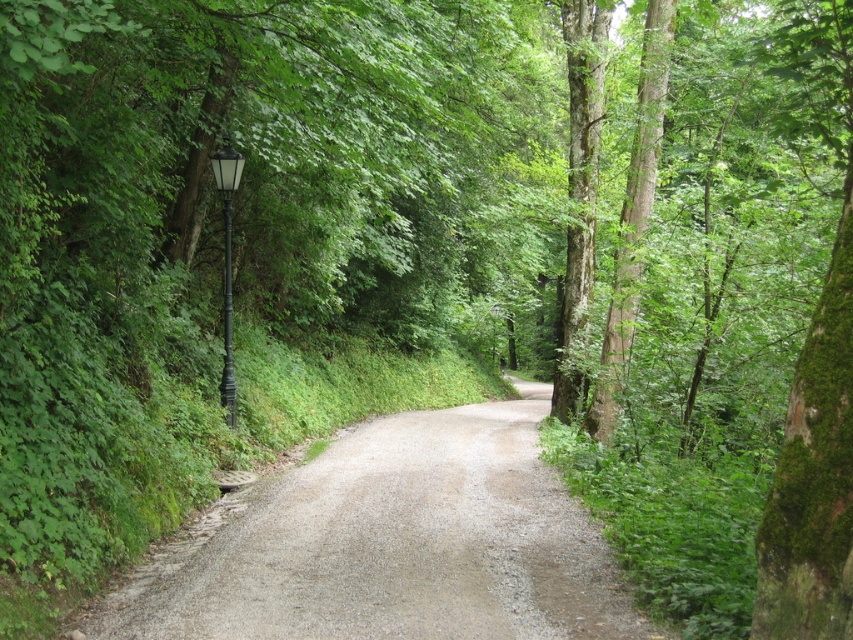
You are standing at the start of the gravel path in the forest. You notice two points marked on the path. The first point is at coordinates point (202, 536) and the second point is at point (227, 266). If you were to walk along the path from the starting point, which point would you reach first?

You would reach point (202, 536) first because it is closer to the camera than point (227, 266), meaning it is nearer to your starting position.

You are a hiker who wants to carry a 1.2 meter wide camping tent through the path between the green rough bark tree at center and the black metal lamp post at left. Can the tent pass through the path? Please explain your reasoning.

The green rough bark tree at center has a lesser width compared to black metal lamp post at left. The black metal lamp post at left is wider than the tree. However, the total width of the path isnecessary to determine if the tent can pass. Since the description only compares their widths but not the path width, we cannot confirm if the tent can pass through. More information about the path width is needed.

You are standing at the starting point of the gravel path in the forest. You notice two points marked on the path. The first point is at coordinates point (276,484) and the second point is at coordinates point (654,90). If you want to reach the point that is closer to you, which coordinates should you head towards?

You should head towards point (276,484) because it is closer to the viewer than point (654,90).